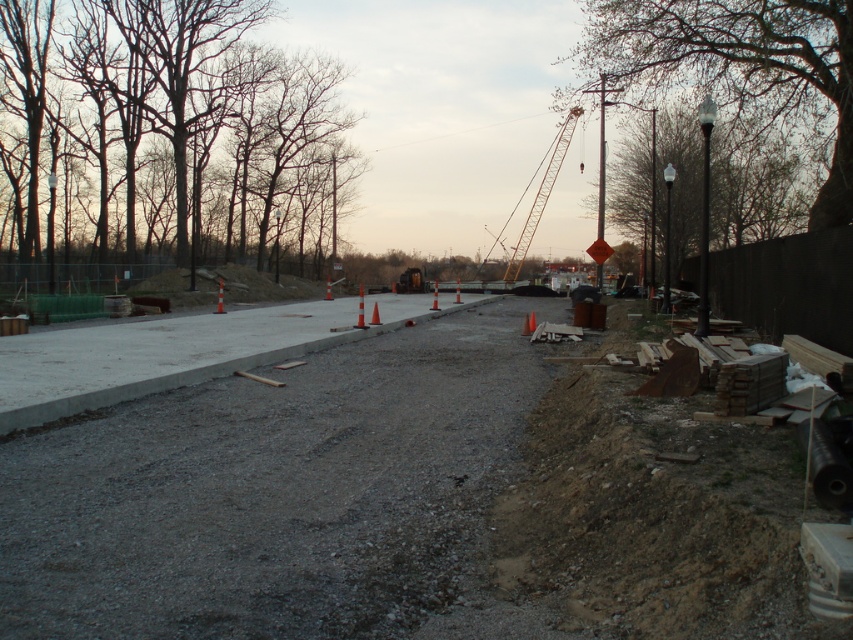
You are a pedestrian walking towards the construction site. You see the brown bark trees at upper left and the smooth gray tree at right. Which tree will appear closer to you as you approach the construction site?

The brown bark trees at upper left will appear closer because they are positioned in front of the smooth gray tree at right.

You are a drone operator trying to capture a photo of the construction site. The camera is currently positioned to focus on the brown bark trees at upper left. To ensure the entire scene is visible, should you pan the camera to the left or right?

The brown bark trees at upper left are located at point (163, 138), so panning the camera to the right would help capture more of the construction site in the frame.